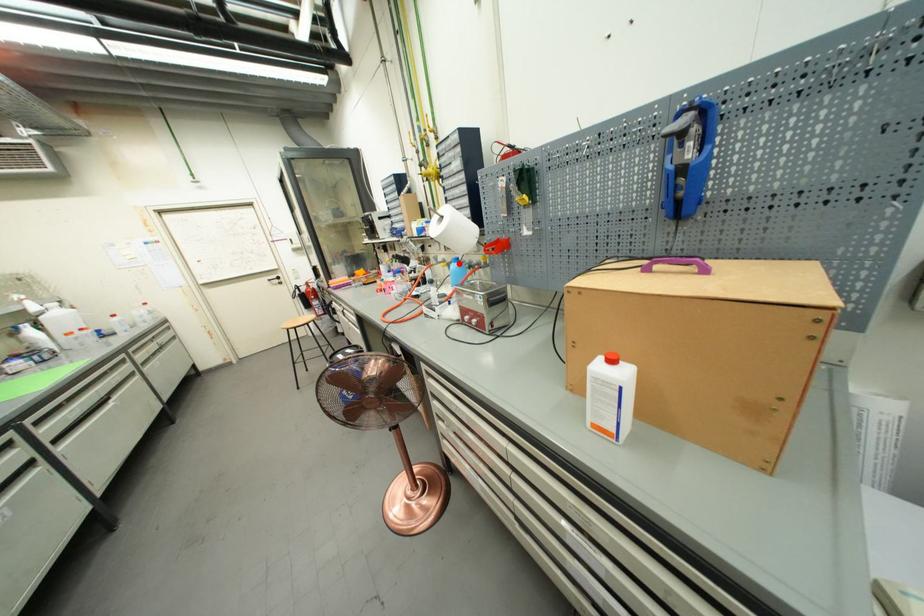
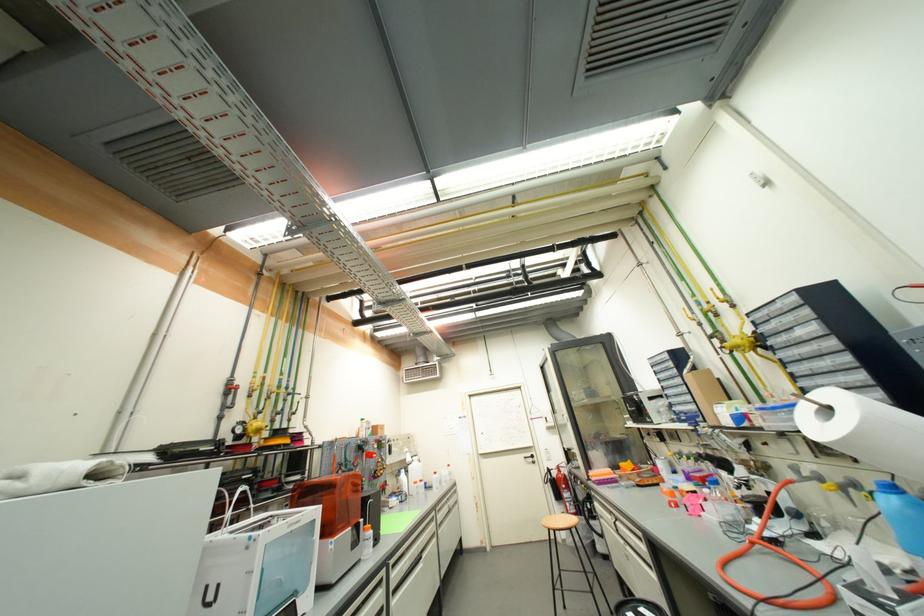
Find the pixel in the second image that matches the highlighted location in the first image.

(889, 493)